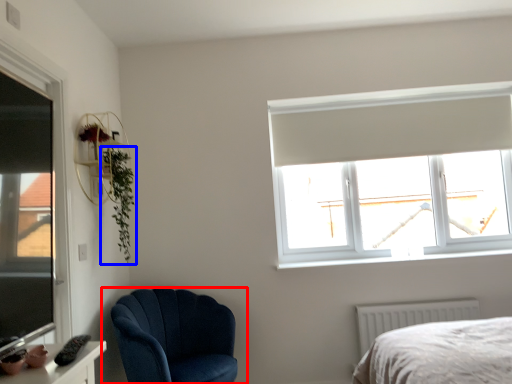
Question: Which of the following is the closest to the observer, chair (highlighted by a red box) or plant (highlighted by a blue box)?

Choices:
 (A) chair
 (B) plant

Answer: (A)